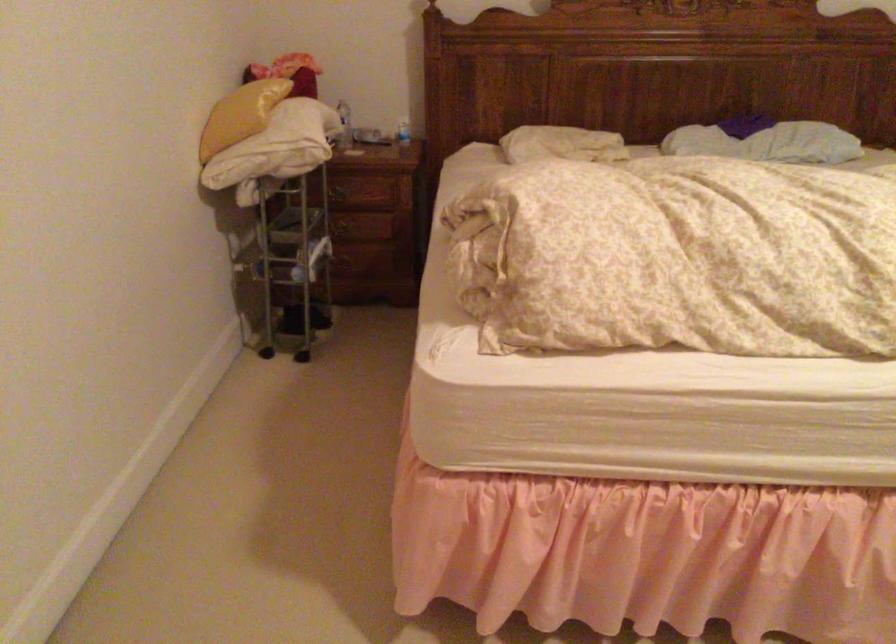
The width and height of the screenshot is (896, 644). In order to click on plastic water bottle in this screenshot , I will do `click(343, 125)`.